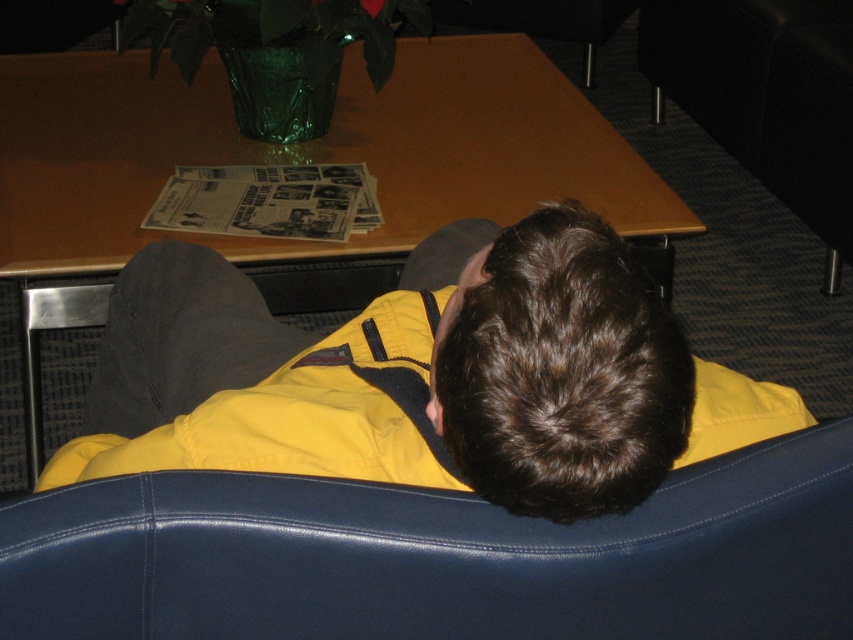
In the scene shown: How distant is leather-like blue armchair at center from wooden table at center?

A distance of 1.22 meters exists between leather-like blue armchair at center and wooden table at center.

From the picture: How much distance is there between leather-like blue armchair at center and wooden table at center?

They are 4.00 feet apart.

Is point (651, 609) farther from viewer compared to point (309, 157)?

No, (651, 609) is in front of (309, 157).

Locate an element on the screen. The width and height of the screenshot is (853, 640). leather-like blue armchair at center is located at coordinates (438, 556).

From the picture: Who is higher up, leather-like blue armchair at center or dark brown hair at center?

Positioned higher is dark brown hair at center.

Does point (821, 486) come closer to viewer compared to point (566, 408)?

No, it is not.

Locate an element on the screen. Image resolution: width=853 pixels, height=640 pixels. leather-like blue armchair at center is located at coordinates (438, 556).

Is dark brown hair at center positioned before black leather couch at lower right?

That is True.

Does dark brown hair at center have a lesser width compared to black leather couch at lower right?

Indeed, dark brown hair at center has a lesser width compared to black leather couch at lower right.

The image size is (853, 640). I want to click on dark brown hair at center, so click(x=560, y=371).